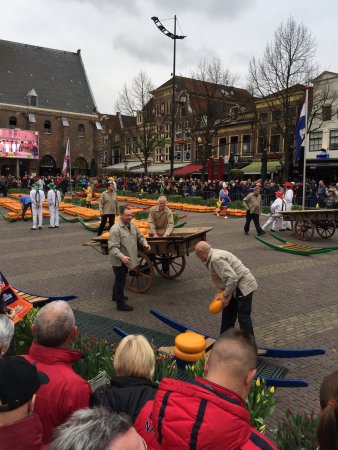
Find the location of a particular element. coat is located at coordinates (222, 273), (126, 239), (166, 215), (110, 206).